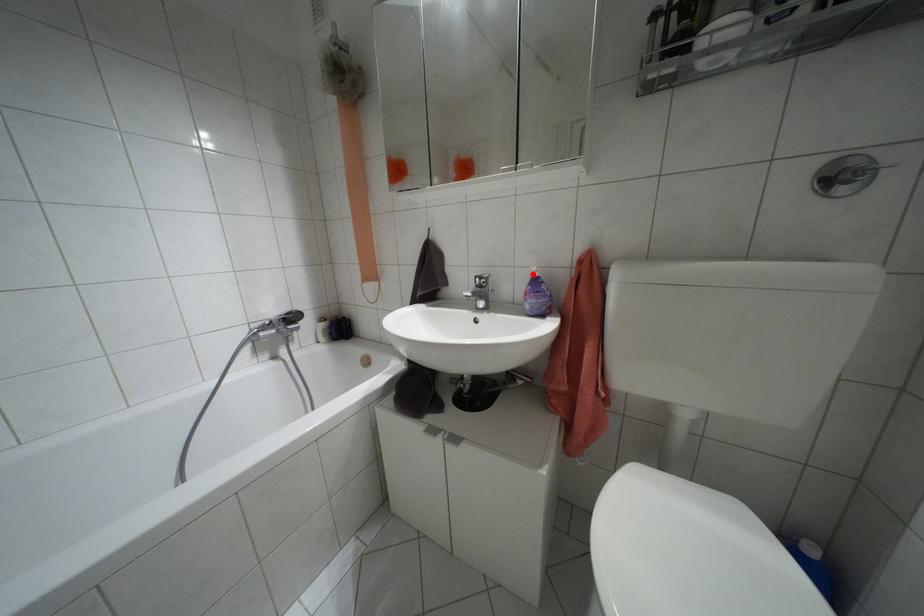
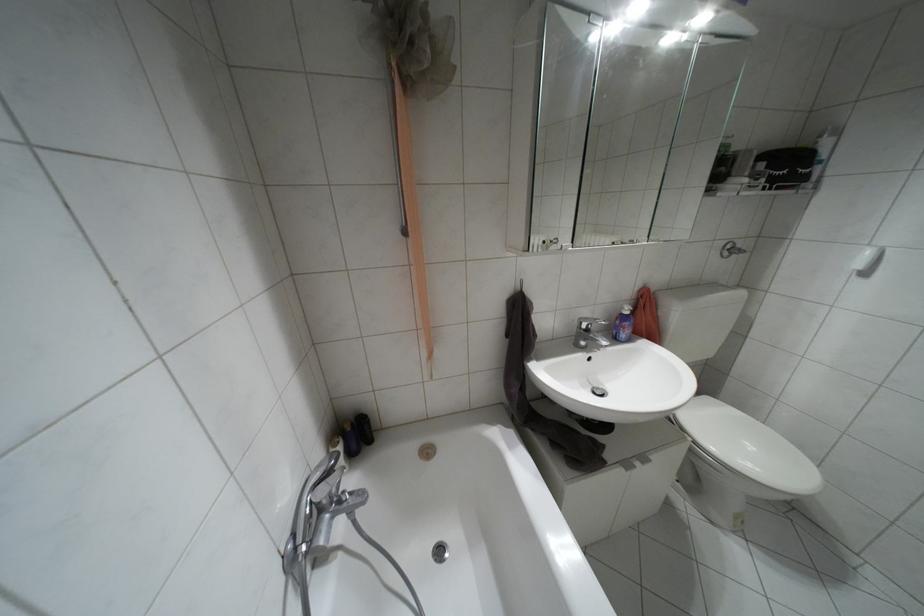
In the second image, find the point that corresponds to the highlighted location in the first image.

(626, 312)